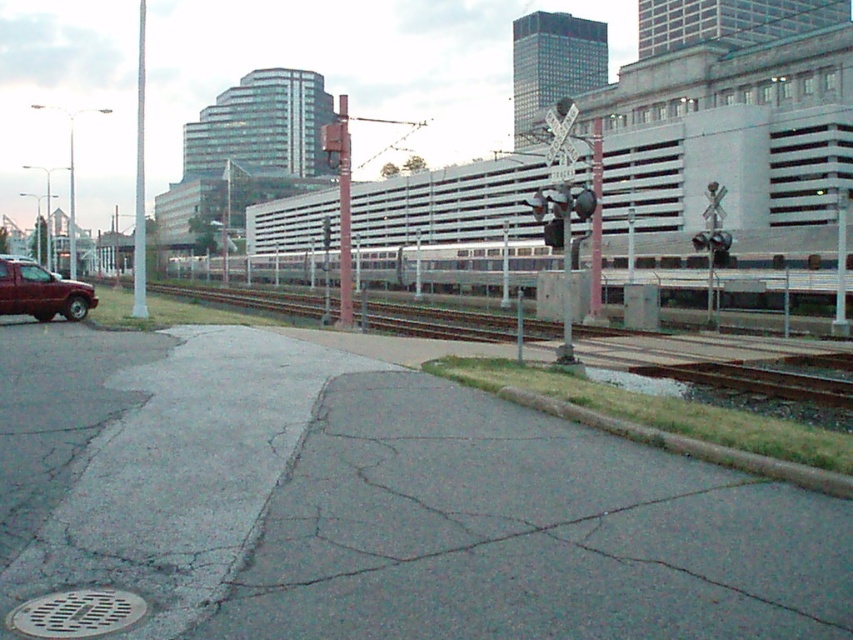
Question: Which is farther from the metallic gray pole at center?

Choices:
 (A) silver metallic train at center
 (B) metallic pole at center

Answer: (B)

Question: Can you confirm if matte red truck at left is positioned above metallic gray pole at center?

Choices:
 (A) no
 (B) yes

Answer: (A)

Question: Estimate the real-world distances between objects in this image. Which object is closer to the metallic gray pole at center?

Choices:
 (A) metallic pole at center
 (B) silver metallic train at center

Answer: (B)

Question: Observing the image, what is the correct spatial positioning of metallic gray pole at center in reference to white glossy pole at center?

Choices:
 (A) left
 (B) right

Answer: (B)

Question: Can you confirm if silver metallic train at center is positioned to the right of white glossy pole at center?

Choices:
 (A) yes
 (B) no

Answer: (A)

Question: Which of the following is the farthest from the observer?

Choices:
 (A) (758, 282)
 (B) (90, 300)
 (C) (337, 321)
 (D) (596, 323)

Answer: (A)